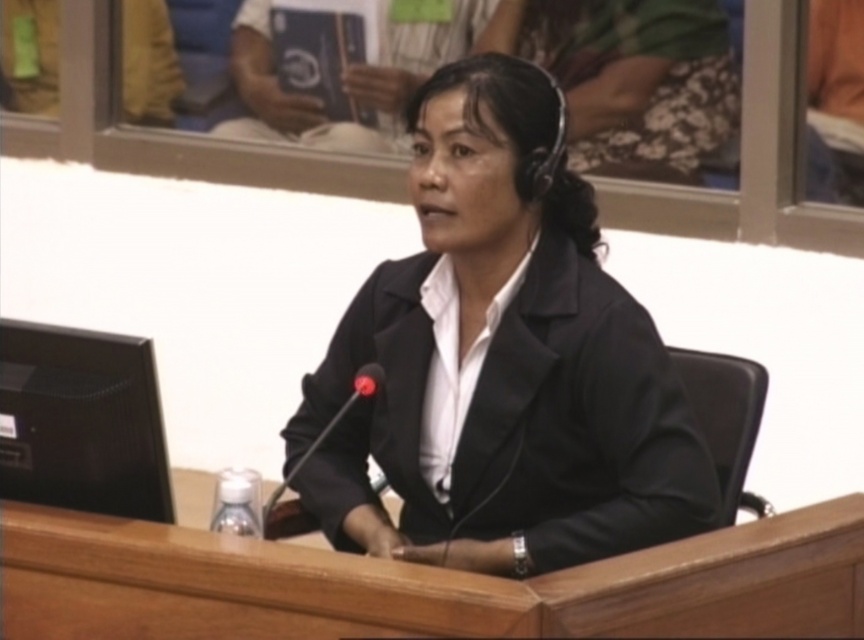
Can you confirm if black matte suit at center is wider than black plastic microphone at center?

Correct, the width of black matte suit at center exceeds that of black plastic microphone at center.

Who is shorter, black matte suit at center or black plastic microphone at center?

Standing shorter between the two is black plastic microphone at center.

Locate an element on the screen. black matte suit at center is located at coordinates (500, 362).